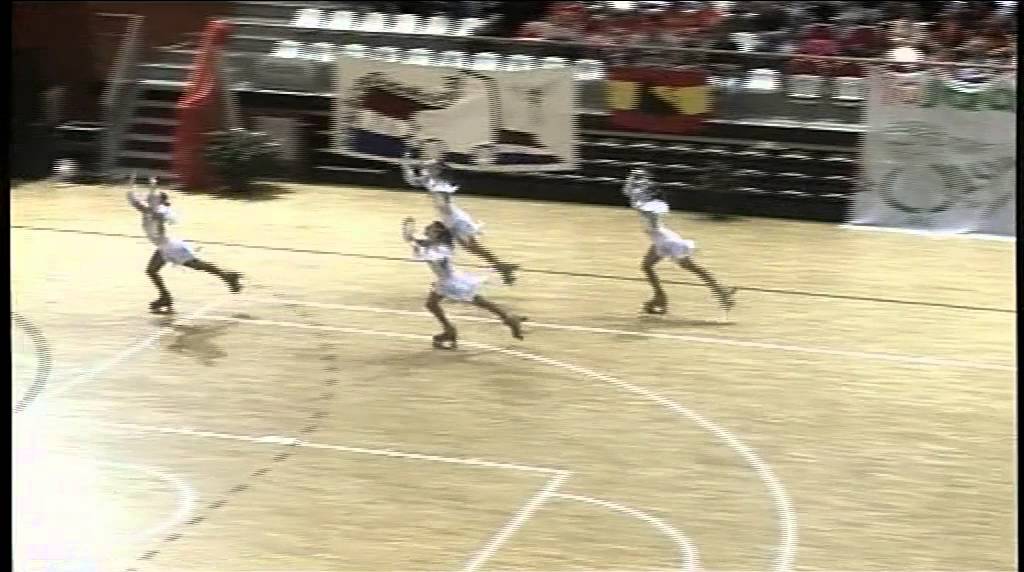
Locate an element on the screen. Image resolution: width=1024 pixels, height=572 pixels. plant is located at coordinates (223, 141).